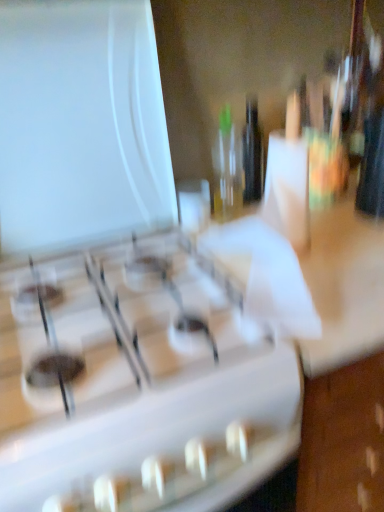
The image size is (384, 512). Find the location of `white glossy gas stove at center`. white glossy gas stove at center is located at coordinates (139, 385).

The height and width of the screenshot is (512, 384). What do you see at coordinates (139, 385) in the screenshot?
I see `white glossy gas stove at center` at bounding box center [139, 385].

Where is `white glossy gas stove at center`? white glossy gas stove at center is located at coordinates (x=139, y=385).